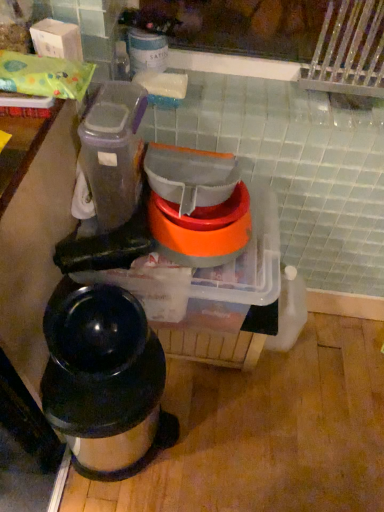
Question: From the image's perspective, is shiny black thermos at lower left above translucent plastic containers at center, the 1th appliance positioned from the bottom?

Choices:
 (A) yes
 (B) no

Answer: (B)

Question: Is shiny black thermos at lower left at the left side of translucent plastic containers at center, which appears as the 3th appliance when viewed from the top?

Choices:
 (A) no
 (B) yes

Answer: (B)

Question: Could you tell me if shiny black thermos at lower left is facing translucent plastic containers at center, the 1th appliance positioned from the bottom?

Choices:
 (A) no
 (B) yes

Answer: (A)

Question: Is translucent plastic containers at center, the 1th appliance positioned from the bottom, at the back of shiny black thermos at lower left?

Choices:
 (A) no
 (B) yes

Answer: (B)

Question: Considering the relative sizes of shiny black thermos at lower left and translucent plastic containers at center, the 1th appliance positioned from the bottom, in the image provided, is shiny black thermos at lower left thinner than translucent plastic containers at center, the 1th appliance positioned from the bottom,?

Choices:
 (A) no
 (B) yes

Answer: (B)

Question: Can you confirm if shiny black thermos at lower left is wider than translucent plastic containers at center, the 1th appliance positioned from the bottom?

Choices:
 (A) no
 (B) yes

Answer: (A)

Question: From the image's perspective, is translucent plastic container at upper left, acting as the 1th appliance starting from the top, under translucent plastic containers at center, which appears as the 3th appliance when viewed from the top?

Choices:
 (A) yes
 (B) no

Answer: (B)

Question: Would you say translucent plastic container at upper left, acting as the 1th appliance starting from the top, is outside translucent plastic containers at center, which appears as the 3th appliance when viewed from the top?

Choices:
 (A) yes
 (B) no

Answer: (A)

Question: Is translucent plastic container at upper left, which is the 3th appliance in bottom-to-top order, not close to translucent plastic containers at center, which appears as the 3th appliance when viewed from the top?

Choices:
 (A) yes
 (B) no

Answer: (B)

Question: Is translucent plastic container at upper left, acting as the 1th appliance starting from the top, beside translucent plastic containers at center, which appears as the 3th appliance when viewed from the top?

Choices:
 (A) no
 (B) yes

Answer: (A)

Question: Considering the relative positions of translucent plastic container at upper left, which is the 3th appliance in bottom-to-top order, and translucent plastic containers at center, which appears as the 3th appliance when viewed from the top, in the image provided, is translucent plastic container at upper left, which is the 3th appliance in bottom-to-top order, to the right of translucent plastic containers at center, which appears as the 3th appliance when viewed from the top, from the viewer's perspective?

Choices:
 (A) no
 (B) yes

Answer: (A)

Question: Is translucent plastic container at upper left, which is the 3th appliance in bottom-to-top order, to the left of translucent plastic containers at center, which appears as the 3th appliance when viewed from the top, from the viewer's perspective?

Choices:
 (A) yes
 (B) no

Answer: (A)

Question: Is translucent plastic containers at center, which appears as the 3th appliance when viewed from the top, surrounding translucent plastic container at upper left, acting as the 1th appliance starting from the top?

Choices:
 (A) yes
 (B) no

Answer: (B)